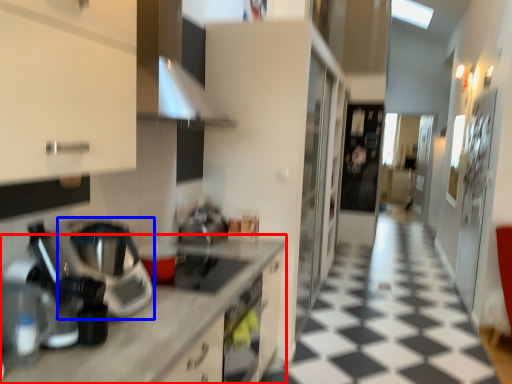
Question: Which object is further to the camera taking this photo, countertop (highlighted by a red box) or home appliance (highlighted by a blue box)?

Choices:
 (A) countertop
 (B) home appliance

Answer: (B)